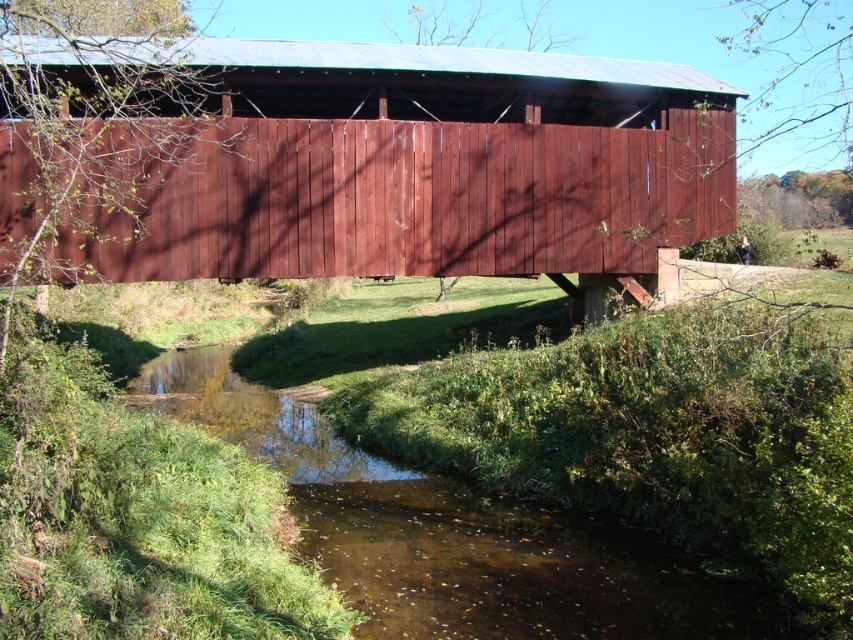
Question: Can you confirm if smooth wood bridge at center is positioned below clear water at center?

Choices:
 (A) yes
 (B) no

Answer: (B)

Question: Can you confirm if smooth wood bridge at center is positioned above clear water at center?

Choices:
 (A) no
 (B) yes

Answer: (B)

Question: In this image, where is smooth wood bridge at center located relative to clear water at center?

Choices:
 (A) above
 (B) below

Answer: (A)